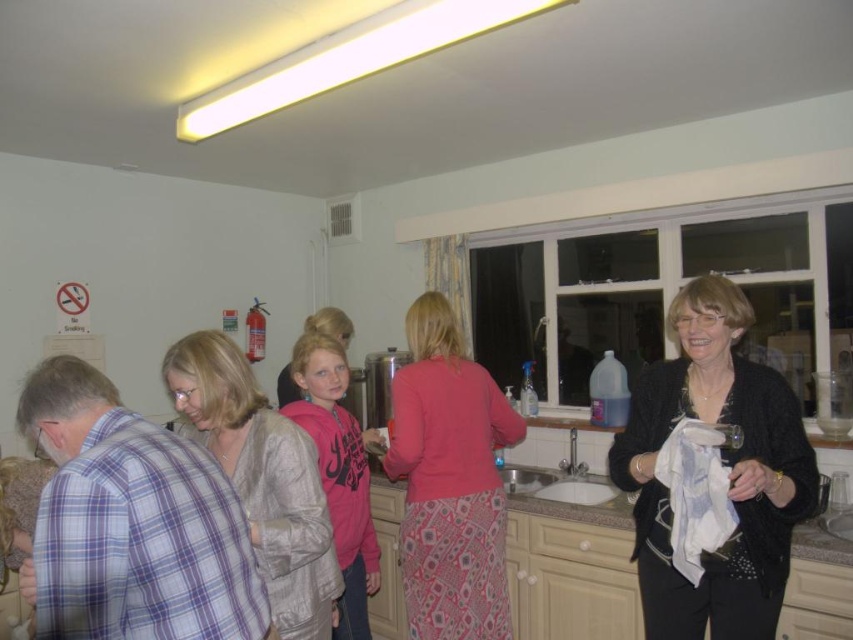
Question: Which of the following is the closest to the observer?

Choices:
 (A) (318, 420)
 (B) (479, 524)
 (C) (233, 374)
 (D) (618, 445)

Answer: (C)

Question: Is silky beige coat at center above white ceramic sink at center?

Choices:
 (A) no
 (B) yes

Answer: (B)

Question: Which object appears closest to the camera in this image?

Choices:
 (A) black knitwear at right
 (B) white ceramic sink at center
 (C) pink fleece jacket at center

Answer: (A)

Question: Is pink fleece jacket at center wider than white ceramic sink at center?

Choices:
 (A) yes
 (B) no

Answer: (B)

Question: Is black knitwear at right to the right of silky beige coat at center from the viewer's perspective?

Choices:
 (A) yes
 (B) no

Answer: (A)

Question: Which is farther from the white ceramic sink at center?

Choices:
 (A) silky beige coat at center
 (B) black knitwear at right
 (C) pink fleece jacket at center

Answer: (A)